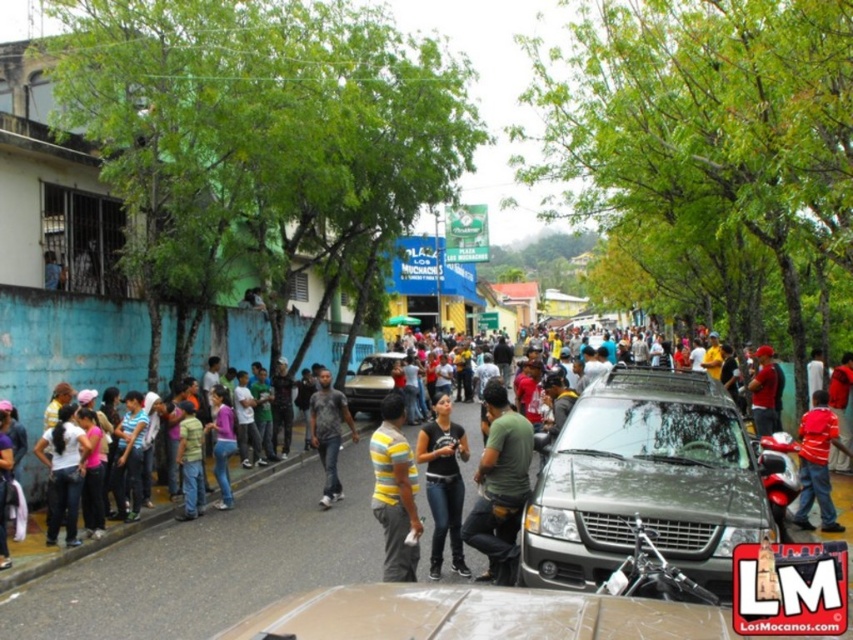
Question: Which point appears farthest from the camera in this image?

Choices:
 (A) (358, 369)
 (B) (759, 490)
 (C) (519, 436)

Answer: (A)

Question: Which object is farther from the camera taking this photo?

Choices:
 (A) black matte shirt at center
 (B) red striped shirt at right

Answer: (B)

Question: Does dark gray shirt at center appear on the right side of metallic gold suv at center?

Choices:
 (A) yes
 (B) no

Answer: (A)

Question: Is red striped shirt at right above metallic gold suv at center?

Choices:
 (A) no
 (B) yes

Answer: (B)

Question: Can you confirm if yellow striped shirt at center is positioned above dark gray shirt at center?

Choices:
 (A) no
 (B) yes

Answer: (B)

Question: Which point is closer to the camera?

Choices:
 (A) black matte shirt at center
 (B) dark gray shirt at center
 (C) matte red cap at center
 (D) metallic gray suv at center

Answer: (D)